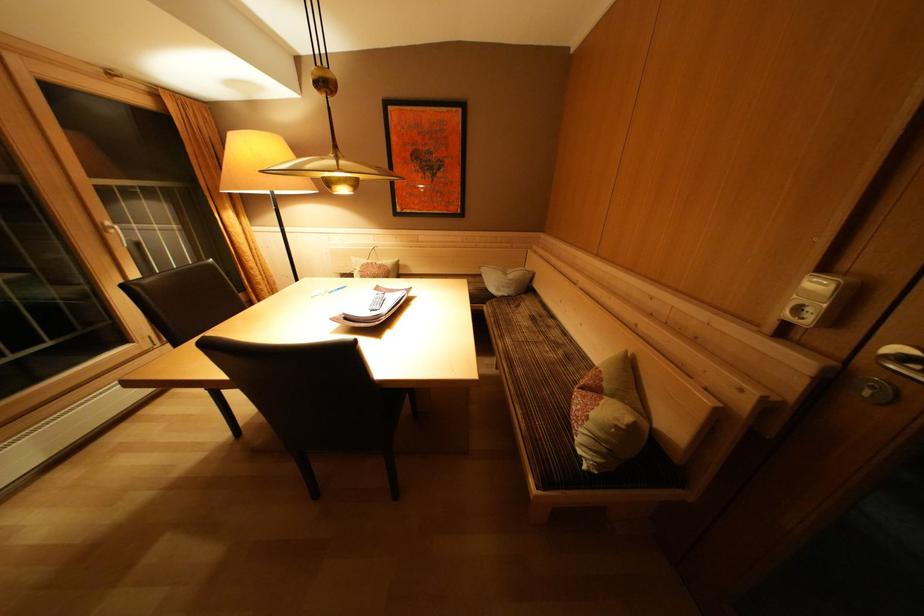
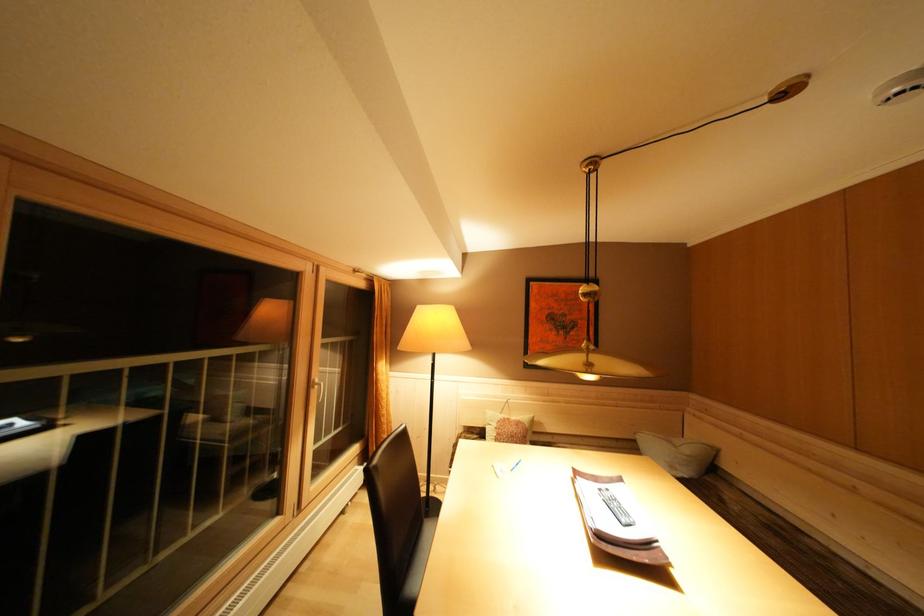
Question: The images are taken continuously from a first-person perspective. In which direction is your viewpoint rotating?

Choices:
 (A) Left
 (B) Right
 (C) Up
 (D) Down

Answer: (C)